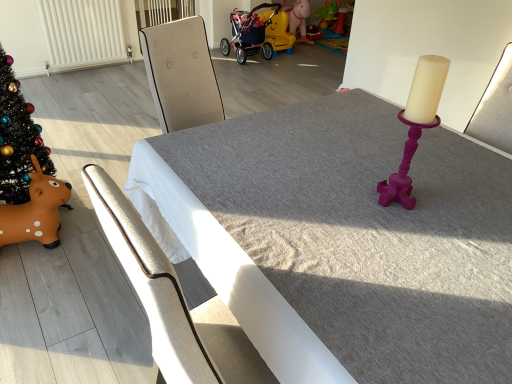
How much space does orange rubber reindeer at lower left, the second toy in the right-to-left sequence, occupy vertically?

The height of orange rubber reindeer at lower left, the second toy in the right-to-left sequence, is 17.67 inches.

You are a GUI agent. You are given a task and a screenshot of the screen. Output one action in this format:
    pyautogui.click(x=<x>, y=<y>)
    Task: Click on the orange rubber reindeer at lower left, which is the 1th toy from left to right
    This screenshot has height=384, width=512.
    Given the screenshot: What is the action you would take?
    pyautogui.click(x=35, y=211)

You are a GUI agent. You are given a task and a screenshot of the screen. Output one action in this format:
    pyautogui.click(x=<x>, y=<y>)
    Task: Click on the shiny black christmas tree at left
    
    Given the screenshot: What is the action you would take?
    pyautogui.click(x=18, y=138)

Image resolution: width=512 pixels, height=384 pixels. Describe the element at coordinates (170, 302) in the screenshot. I see `metallic silver chair at center` at that location.

Consider the image. In order to face smooth gray table at center, should I rotate leftwards or rightwards?

A 13.030 degree turn to the right will do.

What do you see at coordinates (345, 241) in the screenshot? I see `smooth gray table at center` at bounding box center [345, 241].

Image resolution: width=512 pixels, height=384 pixels. Describe the element at coordinates (249, 34) in the screenshot. I see `pink fabric baby carriage at upper center` at that location.

Where is `rubber yellow horse at center, marked as the 1th toy in a right-to-left arrangement`? rubber yellow horse at center, marked as the 1th toy in a right-to-left arrangement is located at coordinates (278, 32).

Is white textured radiator at upper left bigger or smaller than metallic silver chair at center?

Clearly, white textured radiator at upper left is smaller in size than metallic silver chair at center.

How distant is white textured radiator at upper left from metallic silver chair at center?

A distance of 3.80 meters exists between white textured radiator at upper left and metallic silver chair at center.

Which is in front, point (93, 53) or point (155, 306)?

The point (155, 306) is closer.

Does pink fabric baby carriage at upper center touch rubber yellow horse at center, which is the second toy from left to right?

No, pink fabric baby carriage at upper center is not making contact with rubber yellow horse at center, which is the second toy from left to right.

Where is `baby carriage on the left of rubber yellow horse at center, marked as the 1th toy in a right-to-left arrangement`? This screenshot has width=512, height=384. baby carriage on the left of rubber yellow horse at center, marked as the 1th toy in a right-to-left arrangement is located at coordinates (249, 34).

From the image's perspective, is pink fabric baby carriage at upper center below rubber yellow horse at center, which is the second toy in front-to-back order?

Yes, from the image's perspective, pink fabric baby carriage at upper center is beneath rubber yellow horse at center, which is the second toy in front-to-back order.

Considering the relative sizes of pink fabric baby carriage at upper center and rubber yellow horse at center, which is the second toy in front-to-back order, in the image provided, is pink fabric baby carriage at upper center smaller than rubber yellow horse at center, which is the second toy in front-to-back order,?

No, pink fabric baby carriage at upper center is not smaller than rubber yellow horse at center, which is the second toy in front-to-back order.

Does white textured radiator at upper left turn towards rubber yellow horse at center, marked as the 1th toy in a right-to-left arrangement?

No, white textured radiator at upper left is not facing towards rubber yellow horse at center, marked as the 1th toy in a right-to-left arrangement.

Based on the photo, considering the relative sizes of white textured radiator at upper left and rubber yellow horse at center, marked as the 1th toy in a right-to-left arrangement, in the image provided, is white textured radiator at upper left smaller than rubber yellow horse at center, marked as the 1th toy in a right-to-left arrangement,?

No, white textured radiator at upper left is not smaller than rubber yellow horse at center, marked as the 1th toy in a right-to-left arrangement.

Considering their positions, is white textured radiator at upper left located in front of or behind rubber yellow horse at center, which ranks as the 1th toy in top-to-bottom order?

Visually, white textured radiator at upper left is located in front of rubber yellow horse at center, which ranks as the 1th toy in top-to-bottom order.

From a real-world perspective, is white textured radiator at upper left above or below rubber yellow horse at center, the 2th toy when ordered from bottom to top?

white textured radiator at upper left is above rubber yellow horse at center, the 2th toy when ordered from bottom to top.

Looking at the image, does white textured radiator at upper left seem bigger or smaller compared to shiny black christmas tree at left?

In the image, white textured radiator at upper left appears to be smaller than shiny black christmas tree at left.

Considering the positions of points (65, 63) and (45, 158), is point (65, 63) farther from camera compared to point (45, 158)?

Yes.

Which is in front, white textured radiator at upper left or shiny black christmas tree at left?

shiny black christmas tree at left is in front.

Is white textured radiator at upper left outside of shiny black christmas tree at left?

white textured radiator at upper left lies outside shiny black christmas tree at left's area.

How distant is shiny black christmas tree at left from white textured radiator at upper left?

The distance of shiny black christmas tree at left from white textured radiator at upper left is 2.19 meters.

Considering the sizes of shiny black christmas tree at left and white textured radiator at upper left in the image, is shiny black christmas tree at left wider or thinner than white textured radiator at upper left?

In the image, shiny black christmas tree at left appears to be wider than white textured radiator at upper left.

Which is more to the right, shiny black christmas tree at left or white textured radiator at upper left?

From the viewer's perspective, shiny black christmas tree at left appears more on the right side.

Based on the photo, from the image's perspective, does shiny black christmas tree at left appear lower than white textured radiator at upper left?

Correct, shiny black christmas tree at left appears lower than white textured radiator at upper left in the image.

From a real-world perspective, between orange rubber reindeer at lower left, which is the 1th toy from left to right, and rubber yellow horse at center, marked as the 1th toy in a right-to-left arrangement, who is vertically lower?

From a 3D spatial view, orange rubber reindeer at lower left, which is the 1th toy from left to right, is below.

Looking at this image, what's the angular difference between orange rubber reindeer at lower left, which is the 1th toy from left to right, and rubber yellow horse at center, marked as the 1th toy in a right-to-left arrangement,'s facing directions?

84.6 degrees separate the facing orientations of orange rubber reindeer at lower left, which is the 1th toy from left to right, and rubber yellow horse at center, marked as the 1th toy in a right-to-left arrangement.

Does point (55, 212) come closer to viewer compared to point (274, 39)?

That is True.

Considering the sizes of objects orange rubber reindeer at lower left, the first toy from the bottom, and rubber yellow horse at center, which is the second toy in front-to-back order, in the image provided, who is bigger, orange rubber reindeer at lower left, the first toy from the bottom, or rubber yellow horse at center, which is the second toy in front-to-back order,?

Bigger between the two is rubber yellow horse at center, which is the second toy in front-to-back order.

Between smooth gray table at center and metallic silver chair at center, which one appears on the right side from the viewer's perspective?

smooth gray table at center.

From a real-world perspective, which object stands above the other?

metallic silver chair at center.

Considering the sizes of objects smooth gray table at center and metallic silver chair at center in the image provided, who is bigger, smooth gray table at center or metallic silver chair at center?

Bigger between the two is smooth gray table at center.

Can you confirm if smooth gray table at center is taller than metallic silver chair at center?

Incorrect, the height of smooth gray table at center is not larger of that of metallic silver chair at center.

Find the location of a particular element. furniture in front of the white textured radiator at upper left is located at coordinates (170, 302).

I want to click on toy above the pink fabric baby carriage at upper center (from the image's perspective), so [x=278, y=32].

Based on their spatial positions, is smooth gray table at center or rubber yellow horse at center, the first toy viewed from the back, further from orange rubber reindeer at lower left, the 2th toy in the top-to-bottom sequence?

rubber yellow horse at center, the first toy viewed from the back, is positioned further to the anchor orange rubber reindeer at lower left, the 2th toy in the top-to-bottom sequence.

From the image, which object appears to be nearer to orange rubber reindeer at lower left, the first toy from the bottom, smooth gray table at center or pink fabric baby carriage at upper center?

smooth gray table at center is closer to orange rubber reindeer at lower left, the first toy from the bottom.

Which object lies further to the anchor point orange rubber reindeer at lower left, the 1th toy in the front-to-back sequence, white textured radiator at upper left or metallic silver chair at center?

Among the two, white textured radiator at upper left is located further to orange rubber reindeer at lower left, the 1th toy in the front-to-back sequence.

Which object lies further to the anchor point smooth gray table at center, rubber yellow horse at center, which ranks as the 1th toy in top-to-bottom order, or pink fabric baby carriage at upper center?

The object further to smooth gray table at center is rubber yellow horse at center, which ranks as the 1th toy in top-to-bottom order.

Estimate the real-world distances between objects in this image. Which object is closer to pink fabric baby carriage at upper center, metallic silver chair at center or shiny black christmas tree at left?

shiny black christmas tree at left is positioned closer to the anchor pink fabric baby carriage at upper center.

Looking at the image, which one is located closer to smooth gray table at center, orange rubber reindeer at lower left, the second toy in the right-to-left sequence, or rubber yellow horse at center, marked as the 1th toy in a right-to-left arrangement?

orange rubber reindeer at lower left, the second toy in the right-to-left sequence, lies closer to smooth gray table at center than the other object.

From the image, which object appears to be nearer to shiny black christmas tree at left, metallic silver chair at center or orange rubber reindeer at lower left, the 2th toy from the back?

orange rubber reindeer at lower left, the 2th toy from the back, lies closer to shiny black christmas tree at left than the other object.

Estimate the real-world distances between objects in this image. Which object is further from smooth gray table at center, rubber yellow horse at center, which ranks as the 1th toy in top-to-bottom order, or metallic silver chair at center?

rubber yellow horse at center, which ranks as the 1th toy in top-to-bottom order, lies further to smooth gray table at center than the other object.

This screenshot has width=512, height=384. In order to click on toy positioned between shiny black christmas tree at left and pink fabric baby carriage at upper center from near to far in this screenshot , I will do `click(35, 211)`.

Find the location of `christmas tree between metallic silver chair at center and rubber yellow horse at center, which ranks as the 1th toy in top-to-bottom order, in the front-back direction`. christmas tree between metallic silver chair at center and rubber yellow horse at center, which ranks as the 1th toy in top-to-bottom order, in the front-back direction is located at coordinates (18, 138).

Where is `radiator located between orange rubber reindeer at lower left, the 2th toy from the back, and pink fabric baby carriage at upper center in the depth direction`? The image size is (512, 384). radiator located between orange rubber reindeer at lower left, the 2th toy from the back, and pink fabric baby carriage at upper center in the depth direction is located at coordinates (83, 33).

Locate an element on the screen. christmas tree located between metallic silver chair at center and orange rubber reindeer at lower left, the 2th toy in the top-to-bottom sequence, in the depth direction is located at coordinates (18, 138).